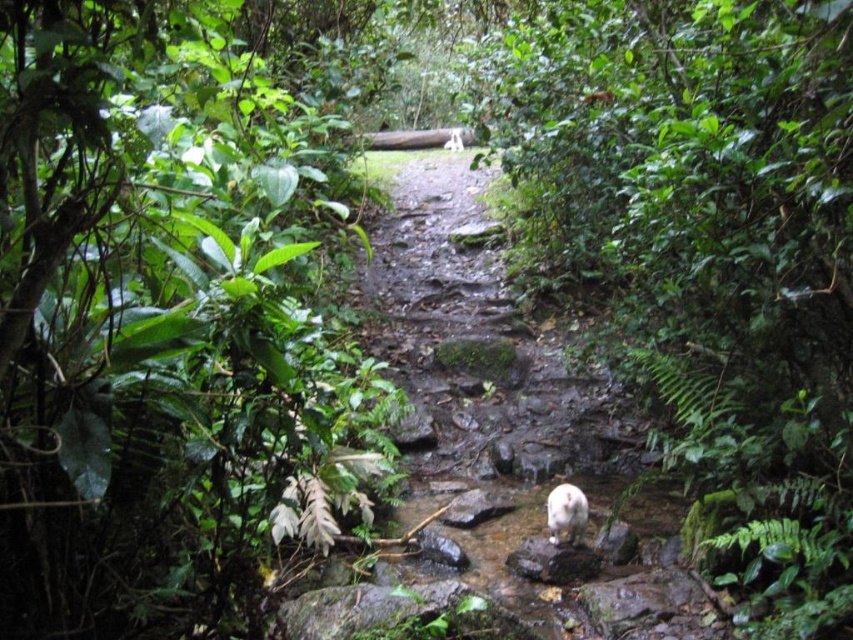
Question: Which object appears closest to the camera in this image?

Choices:
 (A) green leafy vegetation at center
 (B) white fur animal at center
 (C) green leafy plant at left

Answer: (C)

Question: Which object appears closest to the camera in this image?

Choices:
 (A) white fur animal at center
 (B) green leafy plant at left
 (C) green leafy vegetation at center

Answer: (B)

Question: Is green leafy plant at left smaller than white fur animal at center?

Choices:
 (A) yes
 (B) no

Answer: (B)

Question: Can you confirm if green leafy plant at left is positioned to the right of green leafy vegetation at center?

Choices:
 (A) yes
 (B) no

Answer: (B)

Question: Can you confirm if green leafy plant at left is wider than white fur animal at center?

Choices:
 (A) yes
 (B) no

Answer: (A)

Question: Estimate the real-world distances between objects in this image. Which object is farther from the green leafy vegetation at center?

Choices:
 (A) white fur animal at center
 (B) green leafy plant at left

Answer: (B)